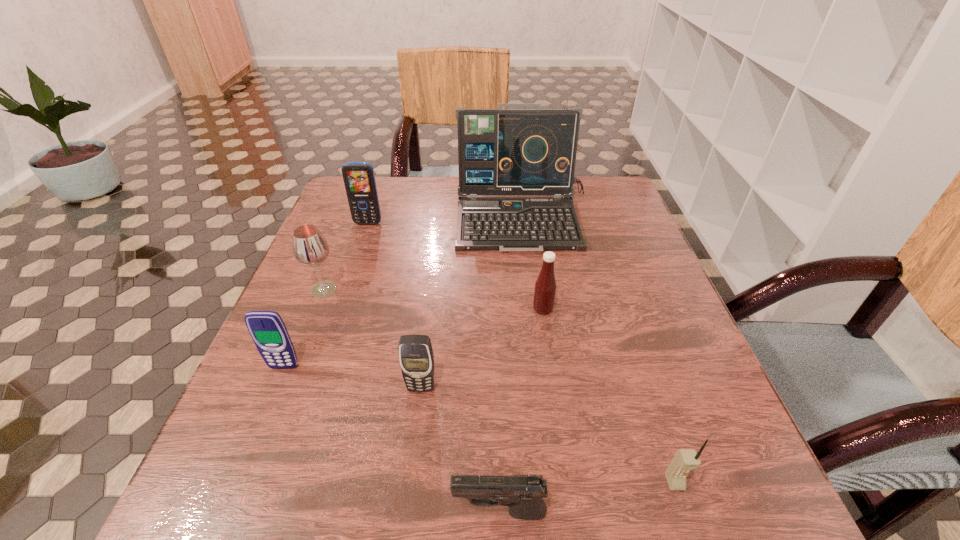
Identify the location of free space that satisfies the following two spatial constraints: 1. on the screen of the Tabasco sauce; 2. on the left side of the tallest cellular telephone. (339, 309).